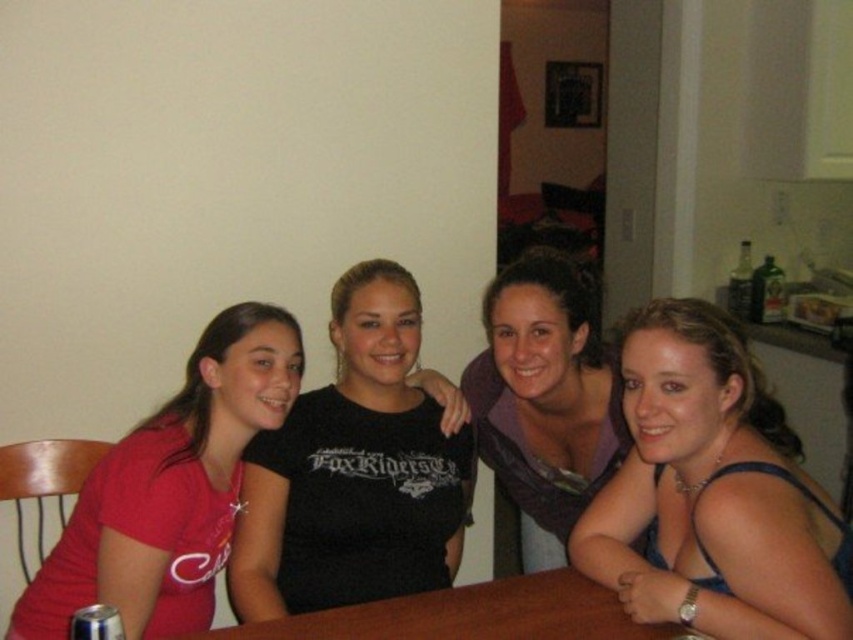
You are at a dining table with four people. The person on the far left is wearing a red short sleeved shirt. The second person from the left is in a black T shirt with white text. The third person has a dark top with a lighter design. The fourth person on the right has a sleeveless top and wavy hair. There is a point marked at coordinate [170,490]. Which person is closest to this point?

The point at [170,490] indicates the matte red shirt at left, so the person on the far left wearing the red short sleeved shirt is closest to this point.

In the scene shown: You are planning to place a rectangular placemat that is 12 inches wide on the table. Given that the matte red shirt at left is narrower than the brown wooden table at center, can the placemat fit on the table?

The matte red shirt at left has a lesser width compared to the brown wooden table at center, so the table is wider than the shirt. Since the placemat is 12 inches wide, it should fit on the table as long as the table is at least 12 inches wide in the area where you want to place it.